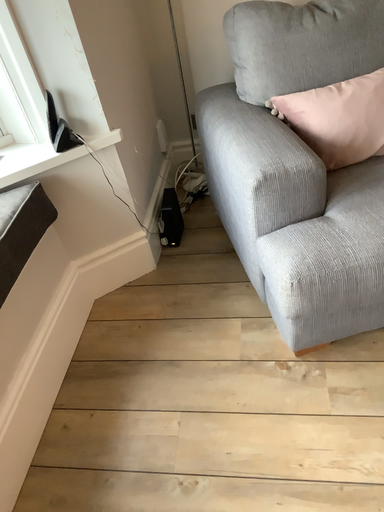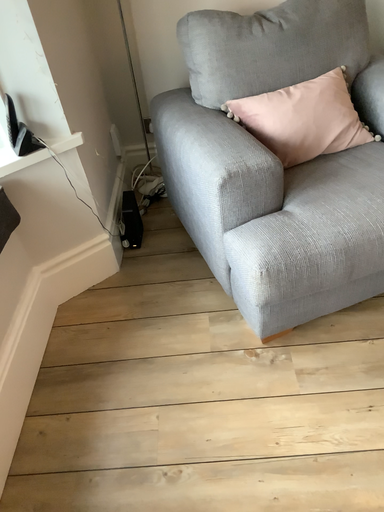
Question: Which way did the camera rotate in the video?

Choices:
 (A) rotated left
 (B) rotated right

Answer: (B)